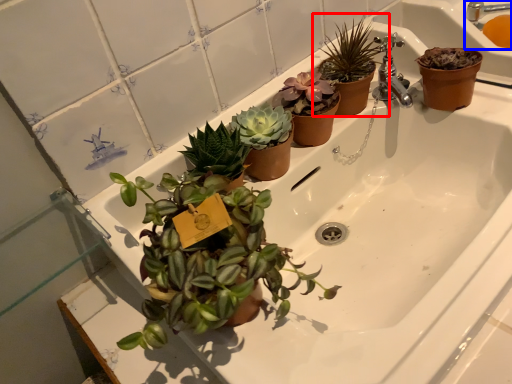
Question: Which object is closer to the camera taking this photo, houseplant (highlighted by a red box) or sink (highlighted by a blue box)?

Choices:
 (A) houseplant
 (B) sink

Answer: (A)